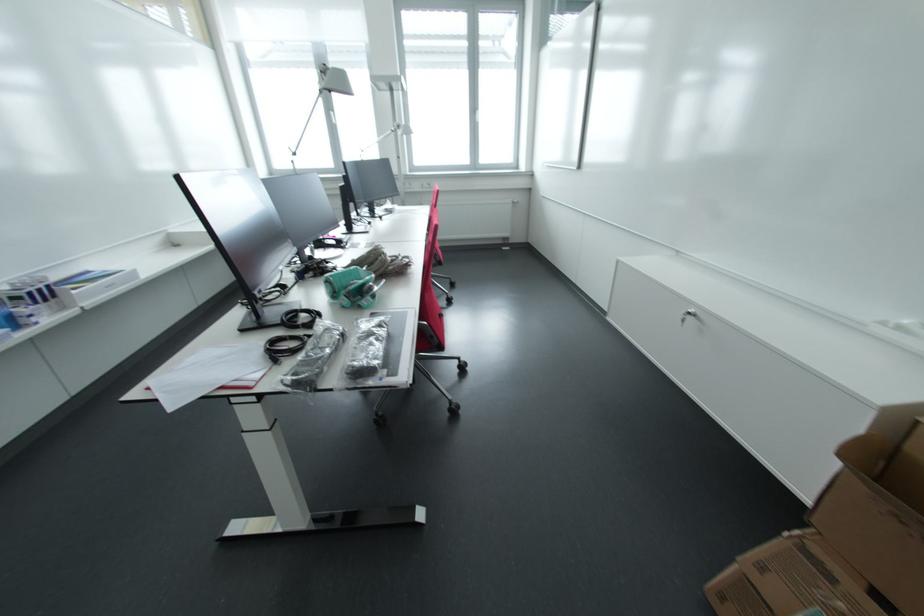
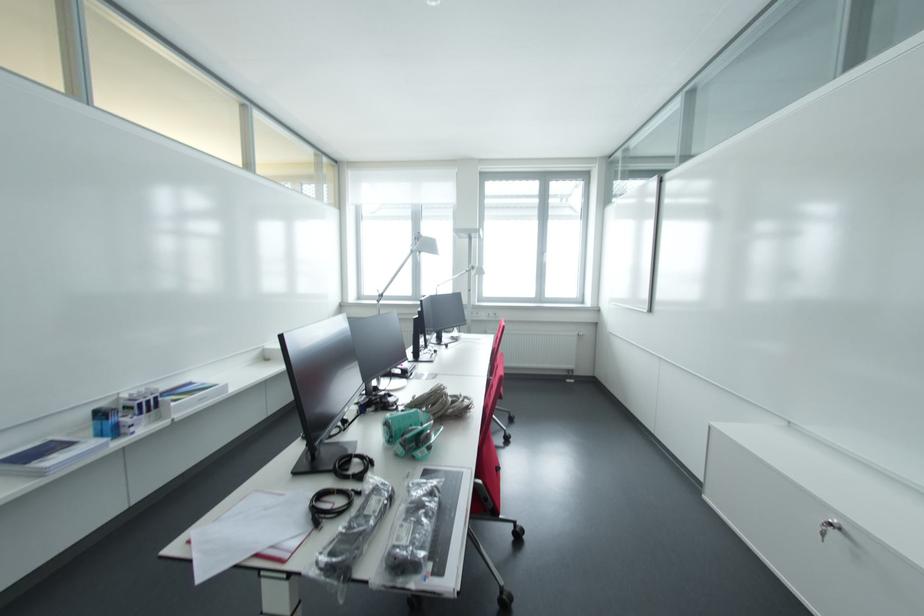
Locate, in the second image, the point that corresponds to (346,308) in the first image.

(400, 456)